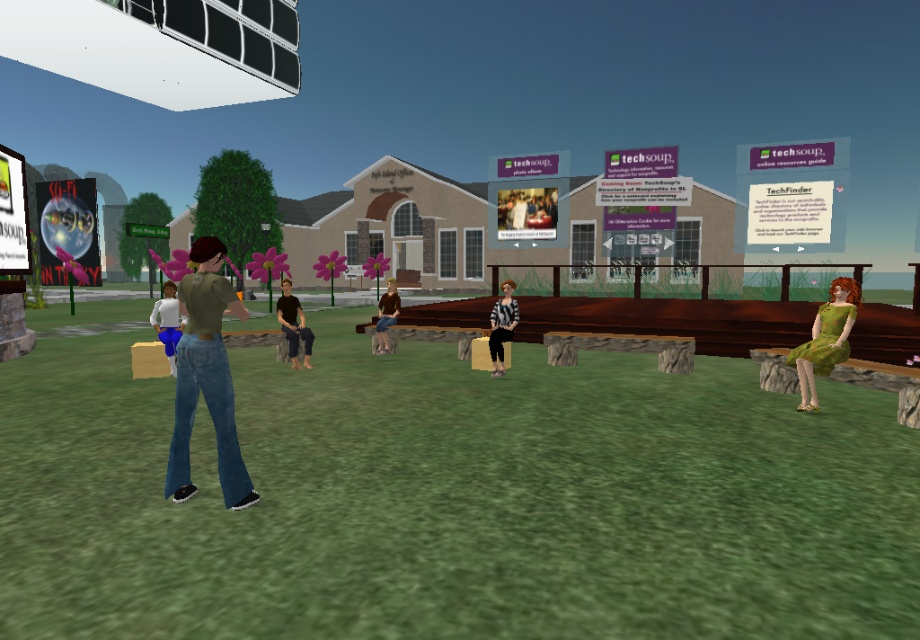
Between point (174, 320) and point (382, 316), which one is positioned in front?

Positioned in front is point (174, 320).

Which is in front, point (159, 304) or point (382, 324)?

Point (159, 304) is in front.

The image size is (920, 640). What are the coordinates of `white matte shirt at center` in the screenshot? It's located at [167, 323].

Between point (286, 314) and point (167, 340), which one is positioned behind?

Positioned behind is point (286, 314).

Can you confirm if dark brown leather pants at center is positioned to the left of white matte shirt at center?

In fact, dark brown leather pants at center is to the right of white matte shirt at center.

Does point (312, 333) come farther from viewer compared to point (150, 323)?

That is False.

Identify the location of dark brown leather pants at center. (x=293, y=324).

Between denim jeans at center and white matte shirt at center, which one appears on the right side from the viewer's perspective?

denim jeans at center

Between denim jeans at center and white matte shirt at center, which one is positioned lower?

denim jeans at center

The image size is (920, 640). In order to click on denim jeans at center in this screenshot , I will do pos(207,378).